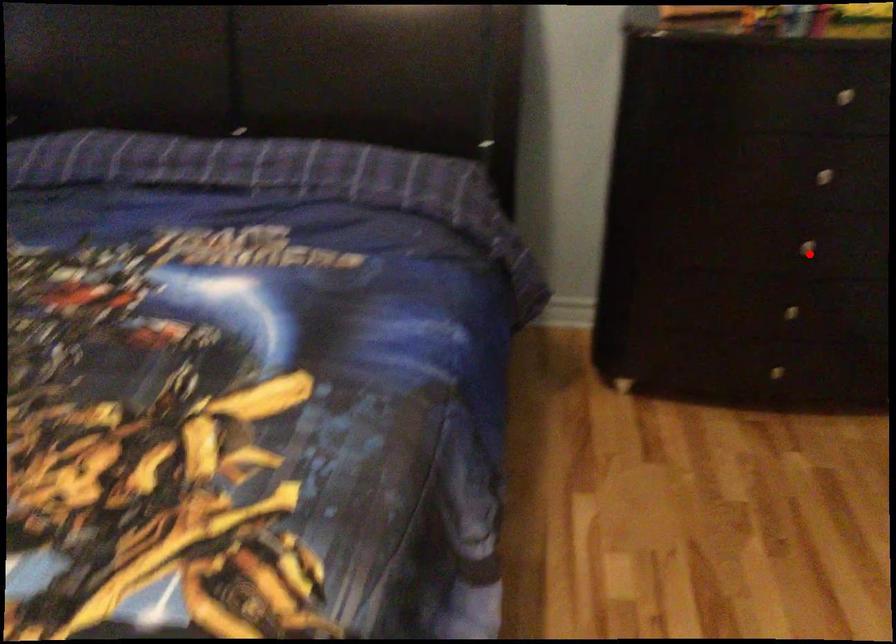
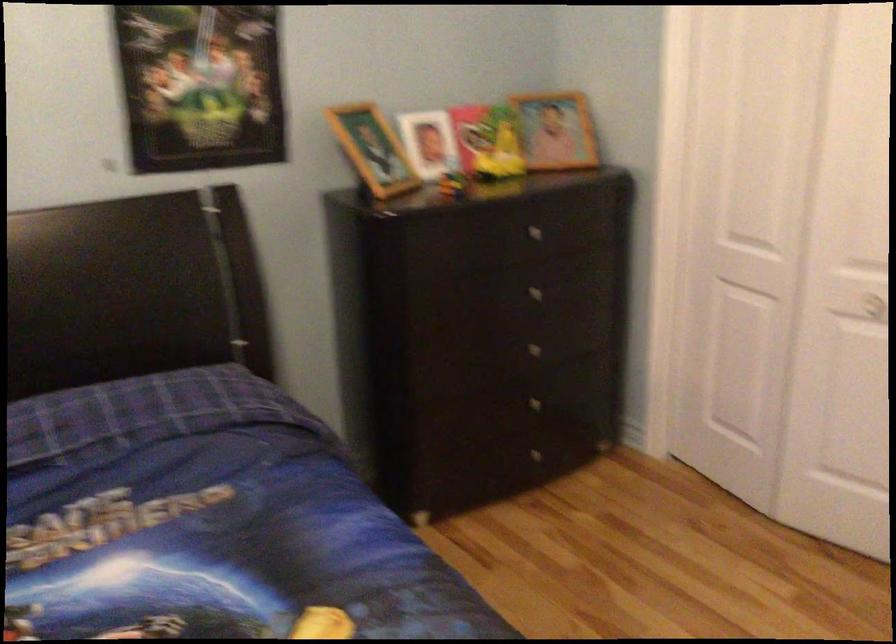
Question: I am providing you with two images of the same scene from different viewpoints. A red point is shown in image1. For the corresponding object point in image2, is it positioned nearer or farther from the camera?

Choices:
 (A) Nearer
 (B) Farther

Answer: (B)